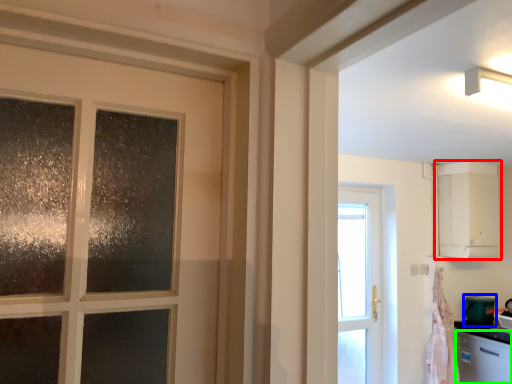
Question: Considering the real-world distances, which object is closest to cabinetry (highlighted by a red box)? appliance (highlighted by a blue box) or dish washer (highlighted by a green box).

Choices:
 (A) appliance
 (B) dish washer

Answer: (A)